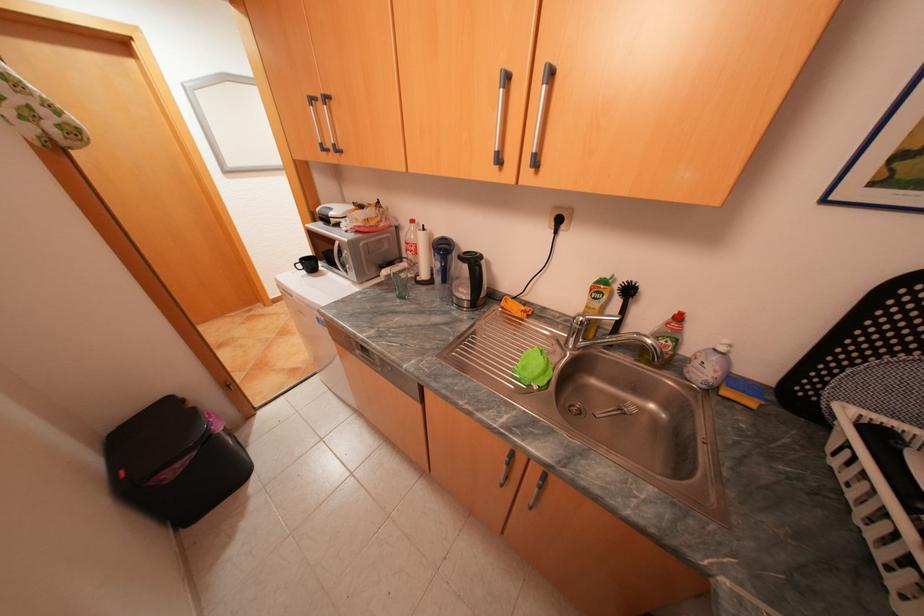
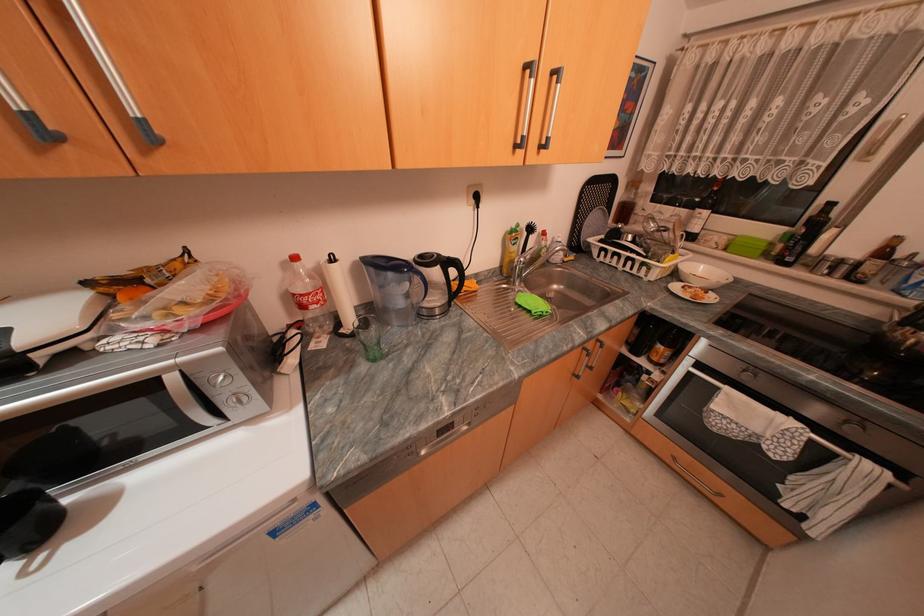
Where in the second image is the point corresponding to point 576,321 from the first image?

(503, 273)